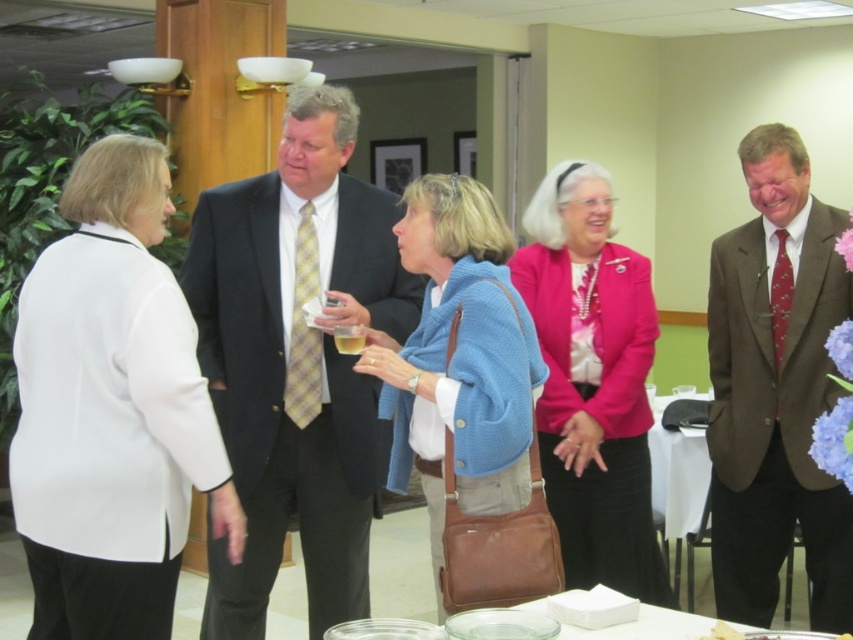
You are a tailor who needs to adjust the jackets to ensure they fit properly. Given that the white fabric jacket at left and the pink satin jacket at center are both for clients with similar body types, which jacket requires more fabric for alterations?

The pink satin jacket at center requires more fabric for alterations because it is wider than the white fabric jacket at left.

You are standing in the conference room and want to greet the person wearing the brown textured suit at center. Based on their position in the room, which direction should you walk to reach them?

The brown textured suit at center is located at coordinates 0.611 on the x axis and 0.910 on the y axis. Since the coordinate system is normalized, you should walk towards the lower right direction to reach the person wearing the brown textured suit at center.